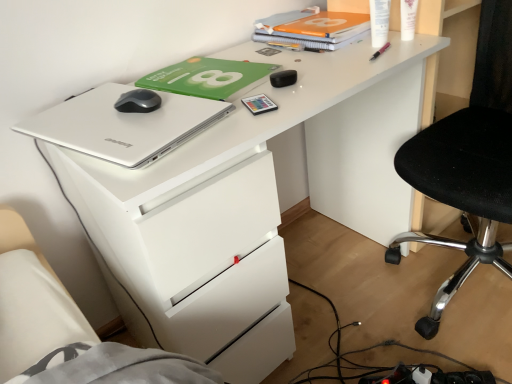
Question: Does matte plastic card at center, which ranks as the 1th stationery in bottom-to-top order, lie in front of orange matte notebook at upper center?

Choices:
 (A) no
 (B) yes

Answer: (B)

Question: Is the position of matte plastic card at center, which ranks as the 1th stationery in bottom-to-top order, more distant than that of orange matte notebook at upper center?

Choices:
 (A) yes
 (B) no

Answer: (B)

Question: From a real-world perspective, is matte plastic card at center, placed as the 5th stationery when sorted from right to left, on top of orange matte notebook at upper center?

Choices:
 (A) no
 (B) yes

Answer: (A)

Question: Is matte plastic card at center, placed as the 5th stationery when sorted from right to left, bigger than orange matte notebook at upper center?

Choices:
 (A) no
 (B) yes

Answer: (A)

Question: From the image's perspective, is matte plastic card at center, which ranks as the 1th stationery in bottom-to-top order, on orange matte notebook at upper center?

Choices:
 (A) yes
 (B) no

Answer: (B)

Question: Is matte plastic card at center, acting as the fifth stationery starting from the top, inside or outside of silver metallic laptop at upper left?

Choices:
 (A) inside
 (B) outside

Answer: (B)

Question: In terms of size, does matte plastic card at center, placed as the 5th stationery when sorted from right to left, appear bigger or smaller than silver metallic laptop at upper left?

Choices:
 (A) small
 (B) big

Answer: (A)

Question: Is matte plastic card at center, which is counted as the 1th stationery, starting from the left, in front of or behind silver metallic laptop at upper left in the image?

Choices:
 (A) front
 (B) behind

Answer: (B)

Question: Considering the positions of point (252, 97) and point (42, 112), is point (252, 97) closer or farther from the camera than point (42, 112)?

Choices:
 (A) farther
 (B) closer

Answer: (B)

Question: Would you say pink plastic pen at upper right, which appears as the third stationery when viewed from the top, is to the left or to the right of matte plastic card at center, placed as the 5th stationery when sorted from right to left, in the picture?

Choices:
 (A) left
 (B) right

Answer: (B)

Question: Does point (382, 51) appear closer or farther from the camera than point (263, 96)?

Choices:
 (A) closer
 (B) farther

Answer: (B)

Question: Is pink plastic pen at upper right, which appears as the third stationery when viewed from the top, spatially inside matte plastic card at center, placed as the 5th stationery when sorted from right to left, or outside of it?

Choices:
 (A) inside
 (B) outside

Answer: (B)

Question: From the image's perspective, is pink plastic pen at upper right, which appears as the third stationery when viewed from the top, located above or below matte plastic card at center, acting as the fifth stationery starting from the top?

Choices:
 (A) below
 (B) above

Answer: (B)

Question: Is pink plastic pen at upper right, which appears as the third stationery when viewed from the right, taller or shorter than orange matte notebook at upper center?

Choices:
 (A) short
 (B) tall

Answer: (A)

Question: Relative to orange matte notebook at upper center, is pink plastic pen at upper right, which appears as the third stationery when viewed from the right, in front or behind?

Choices:
 (A) behind
 (B) front

Answer: (B)